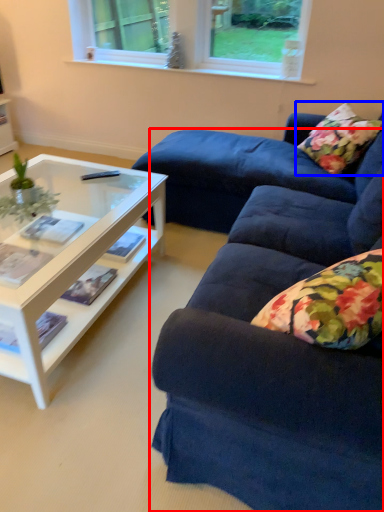
Question: Which of the following is the farthest to the observer, studio couch (highlighted by a red box) or pillow (highlighted by a blue box)?

Choices:
 (A) studio couch
 (B) pillow

Answer: (B)